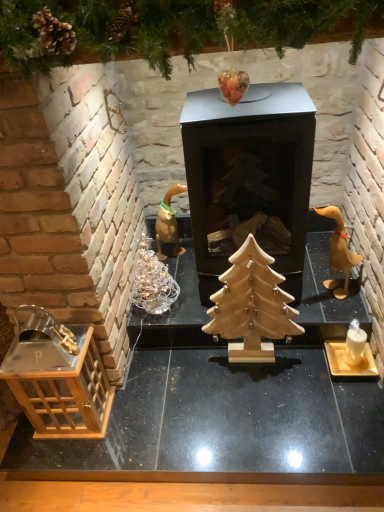
Question: From the image's perspective, is wooden table at lower left above or below matte gold candle holder at lower right?

Choices:
 (A) below
 (B) above

Answer: (A)

Question: Is wooden table at lower left taller or shorter than matte gold candle holder at lower right?

Choices:
 (A) short
 (B) tall

Answer: (A)

Question: Which object is the closest to the transparent glass lantern at lower left?

Choices:
 (A) wooden christmas tree at upper center
 (B) wooden table at lower left
 (C) metallic black fireplace at center
 (D) matte gold candle holder at lower right
 (E) natural wood christmas tree at center

Answer: (B)

Question: Which object is the closest to the metallic black fireplace at center?

Choices:
 (A) matte gold candle holder at lower right
 (B) wooden table at lower left
 (C) wooden christmas tree at upper center
 (D) natural wood christmas tree at center
 (E) transparent glass lantern at lower left

Answer: (D)